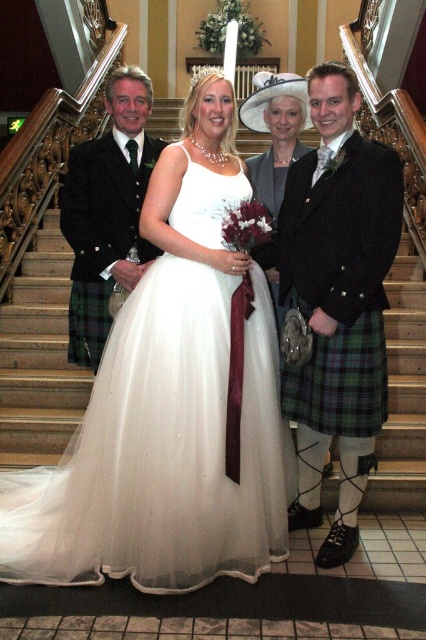
Does point (173, 589) come in front of point (328, 116)?

Yes, point (173, 589) is closer to viewer.

Who is more forward, (184, 417) or (354, 339)?

Point (184, 417) is in front.

Locate an element on the screen. white tulle dress at center is located at coordinates (161, 449).

Who is taller, green plaid kilt at right or matte black kilt at left?

green plaid kilt at right is taller.

Is green plaid kilt at right to the right of matte black kilt at left from the viewer's perspective?

Correct, you'll find green plaid kilt at right to the right of matte black kilt at left.

Image resolution: width=426 pixels, height=640 pixels. What do you see at coordinates (336, 300) in the screenshot?
I see `green plaid kilt at right` at bounding box center [336, 300].

Find the location of a particular element. This screenshot has height=640, width=426. green plaid kilt at right is located at coordinates (336, 300).

Locate an element on the screen. This screenshot has height=640, width=426. white tulle dress at center is located at coordinates (161, 449).

Where is `white tulle dress at center`? white tulle dress at center is located at coordinates (161, 449).